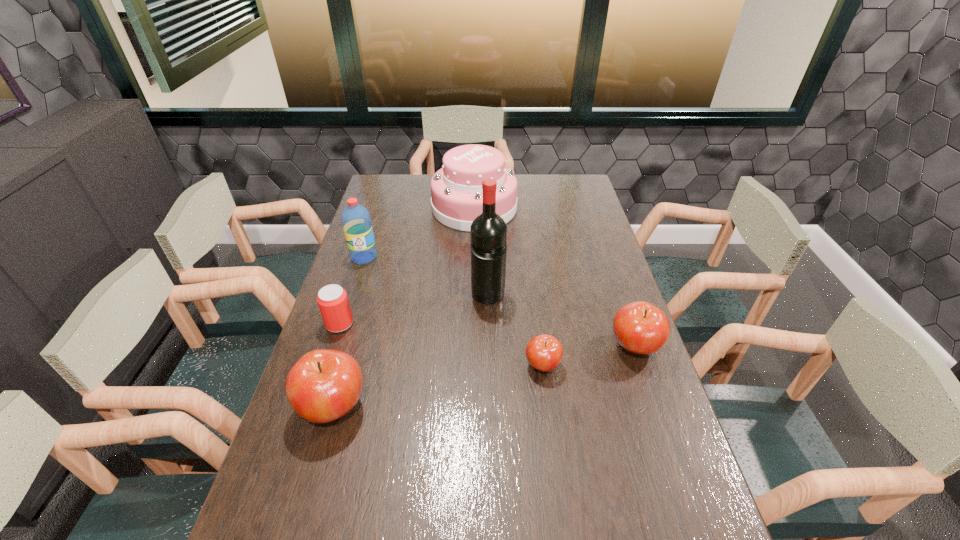
You are a GUI agent. You are given a task and a screenshot of the screen. Output one action in this format:
    pyautogui.click(x=<x>, y=<y>)
    Task: Click on the free space located 0.190m on the front of the leftmost apple
    The height and width of the screenshot is (540, 960).
    Given the screenshot: What is the action you would take?
    pyautogui.click(x=300, y=525)

Identify the location of vacant space located on the back of the second apple from right to left. The height and width of the screenshot is (540, 960). (536, 315).

Locate an element on the screen. This screenshot has width=960, height=540. vacant space located 0.350m on the front of the second tallest apple is located at coordinates (687, 501).

This screenshot has height=540, width=960. Find the location of `vacant region located 0.260m on the left of the farthest object`. vacant region located 0.260m on the left of the farthest object is located at coordinates (369, 208).

Identify the location of free location located on the right of the sixth tallest object. pos(487,323).

Where is `vacant point located on the front label of the second farthest object`? The height and width of the screenshot is (540, 960). vacant point located on the front label of the second farthest object is located at coordinates (347, 310).

The width and height of the screenshot is (960, 540). I want to click on vacant space located 0.320m on the back of the tallest object, so [x=487, y=228].

Where is `object that is at the far edge`? The height and width of the screenshot is (540, 960). object that is at the far edge is located at coordinates (456, 189).

In order to click on apple that is at the left edge in this screenshot , I will do `click(323, 385)`.

Where is `beer can that is at the left edge`? This screenshot has width=960, height=540. beer can that is at the left edge is located at coordinates (x=332, y=300).